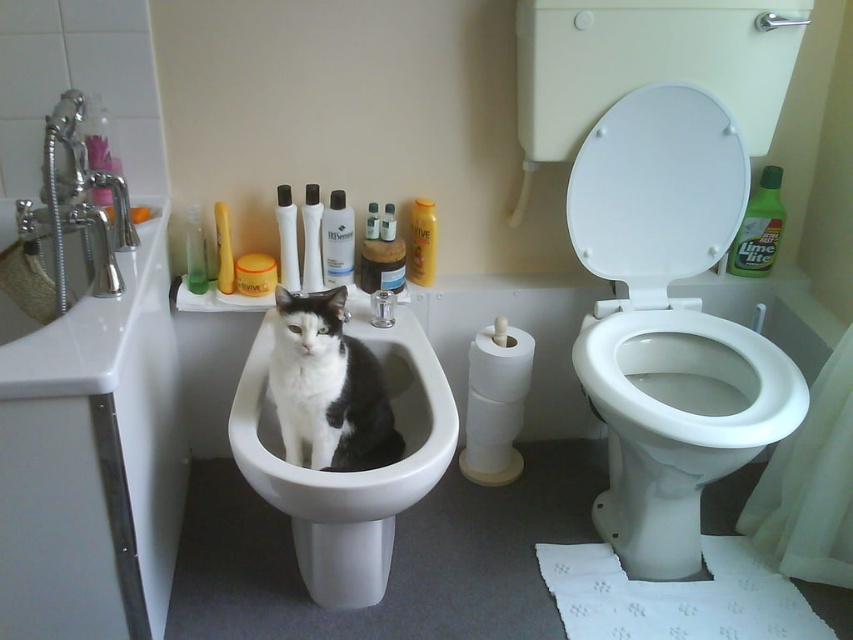
Question: Which point is farther to the camera?

Choices:
 (A) white glossy toilet lid at upper right
 (B) white plastic bottle at center

Answer: (B)

Question: Which of the following is the farthest from the observer?

Choices:
 (A) (285, 268)
 (B) (666, 476)

Answer: (A)

Question: Can you confirm if white glossy bidet at center is thinner than translucent plastic bottle at center?

Choices:
 (A) yes
 (B) no

Answer: (B)

Question: Does white glossy lotion at center appear on the right side of matte yellow lotion at center?

Choices:
 (A) yes
 (B) no

Answer: (B)

Question: Is white glossy lotion at center below white plastic bottle at center?

Choices:
 (A) no
 (B) yes

Answer: (B)

Question: Which of the following is the farthest from the observer?

Choices:
 (A) pos(192,244)
 (B) pos(352,426)

Answer: (A)